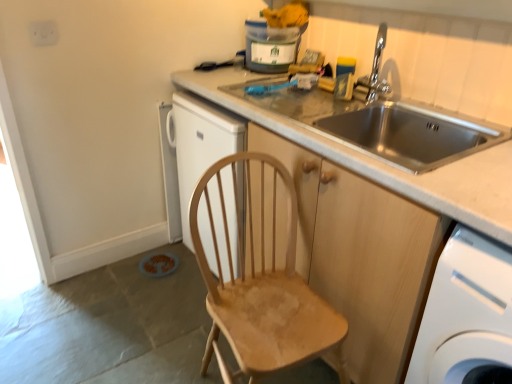
Image resolution: width=512 pixels, height=384 pixels. Identify the location of free space to the left of natural wood chair at center. (153, 355).